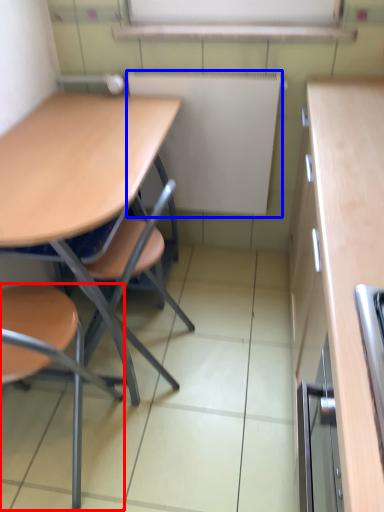
Question: Which point is closer to the camera, chair (highlighted by a red box) or bulletin board (highlighted by a blue box)?

Choices:
 (A) chair
 (B) bulletin board

Answer: (A)